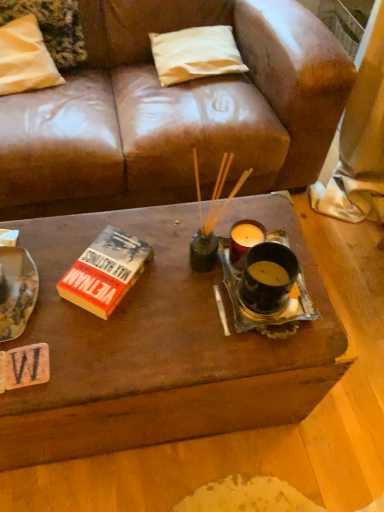
Describe the element at coordinates (25, 58) in the screenshot. The image size is (384, 512). I see `white fabric pillow at upper left, positioned as the 2th pillow in right-to-left order` at that location.

Find the location of a particular element. white fabric pillow at upper left, positioned as the 2th pillow in right-to-left order is located at coordinates (25, 58).

Where is `white fabric pillow at upper center, the second pillow when ordered from left to right`? This screenshot has width=384, height=512. white fabric pillow at upper center, the second pillow when ordered from left to right is located at coordinates (195, 54).

Where is `hardcover book at center-left`? Image resolution: width=384 pixels, height=512 pixels. hardcover book at center-left is located at coordinates (105, 272).

Find the location of a particular element. Image resolution: width=384 pixels, height=512 pixels. white fabric pillow at upper left, positioned as the 2th pillow in right-to-left order is located at coordinates (25, 58).

Are white fabric pillow at upper left, positioned as the 2th pillow in right-to-left order, and white fabric pillow at upper center, which is the first pillow in right-to-left order, making contact?

They are not placed beside each other.

Find the location of a particular element. pillow that appears on the left of white fabric pillow at upper center, which is the first pillow in right-to-left order is located at coordinates (25, 58).

Can we say white fabric pillow at upper left, positioned as the 2th pillow in right-to-left order, lies outside white fabric pillow at upper center, which is the first pillow in right-to-left order?

That's correct, white fabric pillow at upper left, positioned as the 2th pillow in right-to-left order, is outside of white fabric pillow at upper center, which is the first pillow in right-to-left order.

Does point (185, 57) appear closer or farther from the camera than point (48, 73)?

Point (185, 57) is positioned farther from the camera compared to point (48, 73).

Is white fabric pillow at upper center, the second pillow when ordered from left to right, facing towards white fabric pillow at upper left, the first pillow from the left?

No, white fabric pillow at upper center, the second pillow when ordered from left to right, is not oriented towards white fabric pillow at upper left, the first pillow from the left.

Looking at the image, does white fabric pillow at upper center, which is the first pillow in right-to-left order, seem bigger or smaller compared to white fabric pillow at upper left, positioned as the 2th pillow in right-to-left order?

Considering their sizes, white fabric pillow at upper center, which is the first pillow in right-to-left order, takes up less space than white fabric pillow at upper left, positioned as the 2th pillow in right-to-left order.

From the image's perspective, between white fabric pillow at upper center, which is the first pillow in right-to-left order, and white fabric pillow at upper left, positioned as the 2th pillow in right-to-left order, who is located below?

white fabric pillow at upper center, which is the first pillow in right-to-left order, appears lower in the image.

From the picture: Which is more to the right, hardcover book at center-left or white fabric pillow at upper center, the second pillow when ordered from left to right?

white fabric pillow at upper center, the second pillow when ordered from left to right.

Is there a large distance between hardcover book at center-left and white fabric pillow at upper center, the second pillow when ordered from left to right?

No, there isn't a large distance between hardcover book at center-left and white fabric pillow at upper center, the second pillow when ordered from left to right.

Does hardcover book at center-left contain white fabric pillow at upper center, the second pillow when ordered from left to right?

No, white fabric pillow at upper center, the second pillow when ordered from left to right, is not a part of hardcover book at center-left.

Considering the relative sizes of white fabric pillow at upper center, which is the first pillow in right-to-left order, and hardcover book at center-left in the image provided, is white fabric pillow at upper center, which is the first pillow in right-to-left order, shorter than hardcover book at center-left?

No.

From the image's perspective, which one is positioned lower, white fabric pillow at upper center, the second pillow when ordered from left to right, or hardcover book at center-left?

hardcover book at center-left.

From a real-world perspective, is white fabric pillow at upper left, positioned as the 2th pillow in right-to-left order, on hardcover book at center-left?

Yes, from a real-world perspective, white fabric pillow at upper left, positioned as the 2th pillow in right-to-left order, is over hardcover book at center-left

Is white fabric pillow at upper left, the first pillow from the left, at the left side of hardcover book at center-left?

Yes, white fabric pillow at upper left, the first pillow from the left, is to the left of hardcover book at center-left.

Could you tell me if white fabric pillow at upper left, the first pillow from the left, is turned towards hardcover book at center-left?

Yes, white fabric pillow at upper left, the first pillow from the left, is turned towards hardcover book at center-left.

From the picture: How different are the orientations of white fabric pillow at upper left, positioned as the 2th pillow in right-to-left order, and hardcover book at center-left in degrees?

The angle between the facing direction of white fabric pillow at upper left, positioned as the 2th pillow in right-to-left order, and the facing direction of hardcover book at center-left is 40.6 degrees.

Does hardcover book at center-left have a lesser width compared to white fabric pillow at upper left, positioned as the 2th pillow in right-to-left order?

Yes, hardcover book at center-left is thinner than white fabric pillow at upper left, positioned as the 2th pillow in right-to-left order.

Based on the photo, from a real-world perspective, which object rests below the other?

hardcover book at center-left, from a real-world perspective.

How many degrees apart are the facing directions of hardcover book at center-left and white fabric pillow at upper left, positioned as the 2th pillow in right-to-left order?

The angular difference between hardcover book at center-left and white fabric pillow at upper left, positioned as the 2th pillow in right-to-left order, is 40.6 degrees.

Can white fabric pillow at upper left, the first pillow from the left, be found inside hardcover book at center-left?

No, white fabric pillow at upper left, the first pillow from the left, is located outside of hardcover book at center-left.

You are a GUI agent. You are given a task and a screenshot of the screen. Output one action in this format:
    pyautogui.click(x=<x>, y=<y>)
    Task: Click on the pillow above the white fabric pillow at upper center, which is the first pillow in right-to-left order (from a real-world perspective)
    This screenshot has width=384, height=512.
    Given the screenshot: What is the action you would take?
    pyautogui.click(x=25, y=58)

Locate an element on the screen. The image size is (384, 512). pillow that appears above the white fabric pillow at upper center, the second pillow when ordered from left to right (from the image's perspective) is located at coordinates point(25,58).

Estimate the real-world distances between objects in this image. Which object is further from white fabric pillow at upper left, positioned as the 2th pillow in right-to-left order, hardcover book at center-left or white fabric pillow at upper center, which is the first pillow in right-to-left order?

The object further to white fabric pillow at upper left, positioned as the 2th pillow in right-to-left order, is hardcover book at center-left.

When comparing their distances from white fabric pillow at upper left, the first pillow from the left, does white fabric pillow at upper center, which is the first pillow in right-to-left order, or hardcover book at center-left seem further?

hardcover book at center-left is positioned further to the anchor white fabric pillow at upper left, the first pillow from the left.

From the image, which object appears to be farther from hardcover book at center-left, white fabric pillow at upper center, which is the first pillow in right-to-left order, or white fabric pillow at upper left, positioned as the 2th pillow in right-to-left order?

Among the two, white fabric pillow at upper center, which is the first pillow in right-to-left order, is located further to hardcover book at center-left.

When comparing their distances from white fabric pillow at upper center, which is the first pillow in right-to-left order, does white fabric pillow at upper left, positioned as the 2th pillow in right-to-left order, or hardcover book at center-left seem further?

Among the two, hardcover book at center-left is located further to white fabric pillow at upper center, which is the first pillow in right-to-left order.

Considering their positions, is hardcover book at center-left positioned further to white fabric pillow at upper center, which is the first pillow in right-to-left order, than white fabric pillow at upper left, the first pillow from the left?

Based on the image, hardcover book at center-left appears to be further to white fabric pillow at upper center, which is the first pillow in right-to-left order.

From the image, which object appears to be farther from hardcover book at center-left, white fabric pillow at upper left, positioned as the 2th pillow in right-to-left order, or white fabric pillow at upper center, the second pillow when ordered from left to right?

Based on the image, white fabric pillow at upper center, the second pillow when ordered from left to right, appears to be further to hardcover book at center-left.

This screenshot has width=384, height=512. What are the coordinates of `pillow between white fabric pillow at upper left, positioned as the 2th pillow in right-to-left order, and hardcover book at center-left from top to bottom` in the screenshot? It's located at (195, 54).